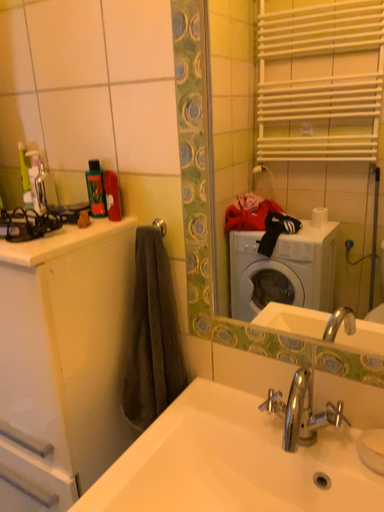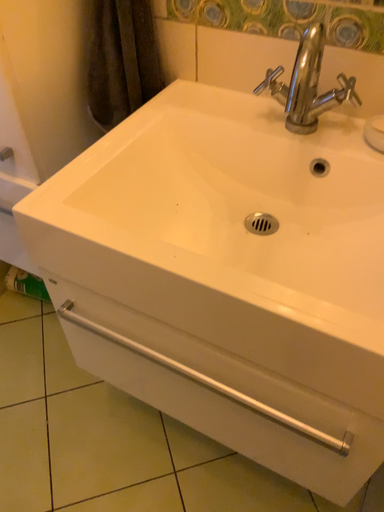
Question: Which way did the camera rotate in the video?

Choices:
 (A) rotated downward
 (B) rotated upward

Answer: (A)